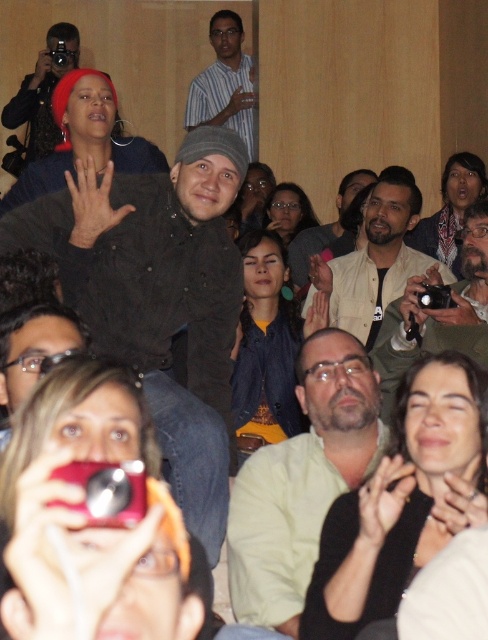
Question: Can you confirm if matte green shirt at center is positioned above beige fabric shirt at center?

Choices:
 (A) no
 (B) yes

Answer: (A)

Question: In this image, where is dark blue denim jacket at center located relative to beige fabric shirt at center?

Choices:
 (A) left
 (B) right

Answer: (A)

Question: Which point appears farthest from the camera in this image?

Choices:
 (A) (382, 397)
 (B) (117, 289)
 (C) (243, 410)

Answer: (C)

Question: Is matte pink camera at lower left further to camera compared to striped cotton shirt at upper center?

Choices:
 (A) no
 (B) yes

Answer: (A)

Question: Which object appears closest to the camera in this image?

Choices:
 (A) striped cotton shirt at upper center
 (B) dark blue denim jacket at center
 (C) matte pink camera at lower left

Answer: (C)

Question: Which object is the farthest from the matte green shirt at center?

Choices:
 (A) matte pink camera at lower left
 (B) light green shirt at center
 (C) matte black headscarf at upper left

Answer: (C)